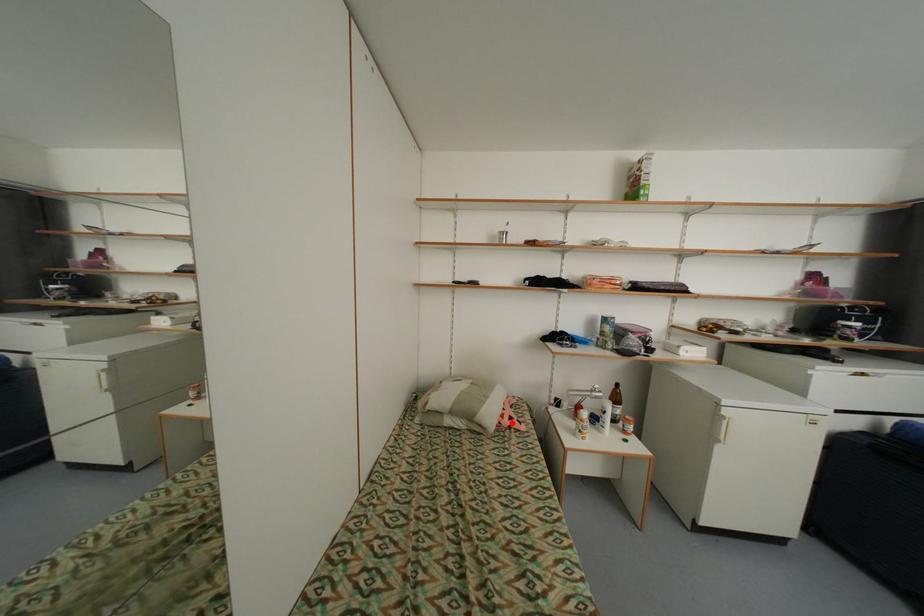
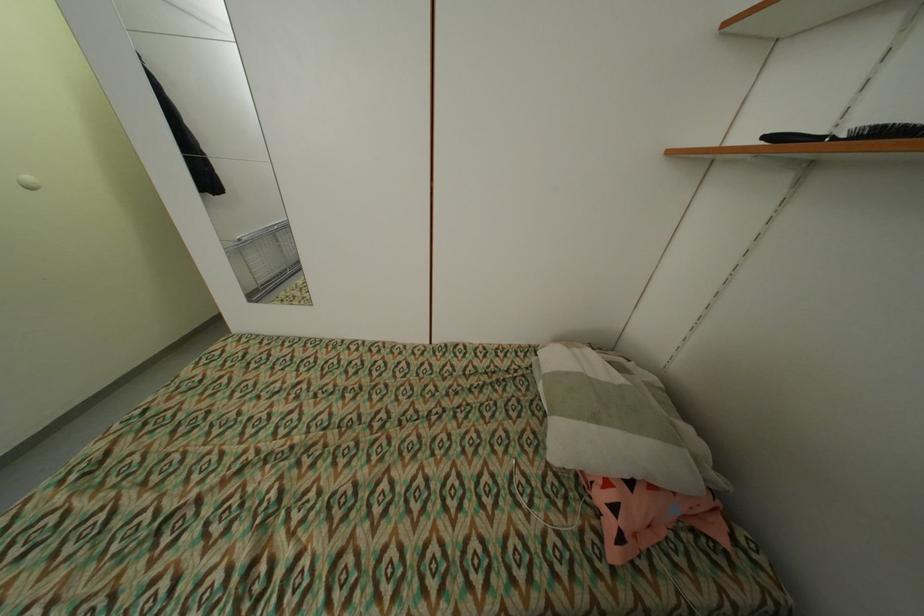
Question: I am providing you with two images of the same scene from different viewpoints. A red point is marked on the first image. Can you still see the location of the red point in image 2?

Choices:
 (A) Yes
 (B) No

Answer: (A)